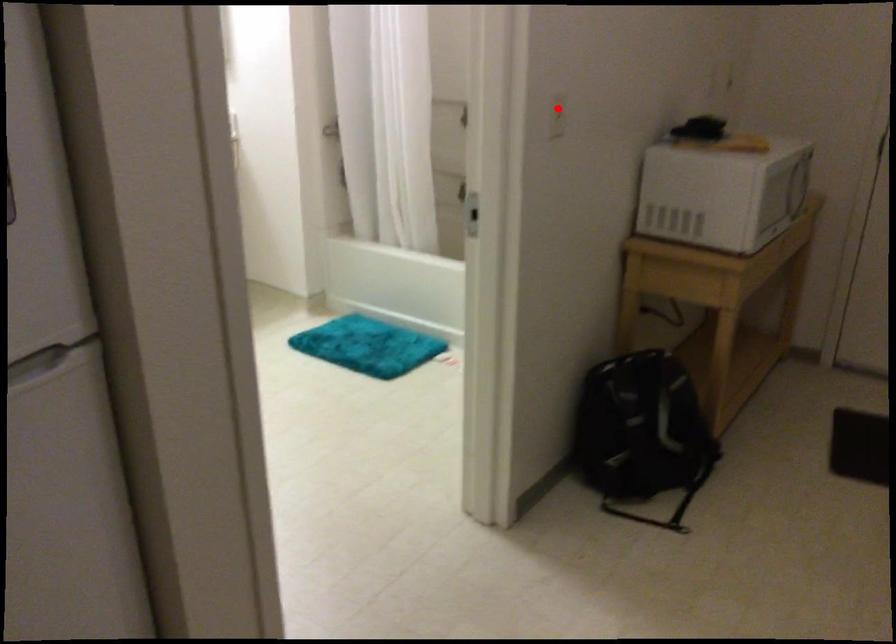
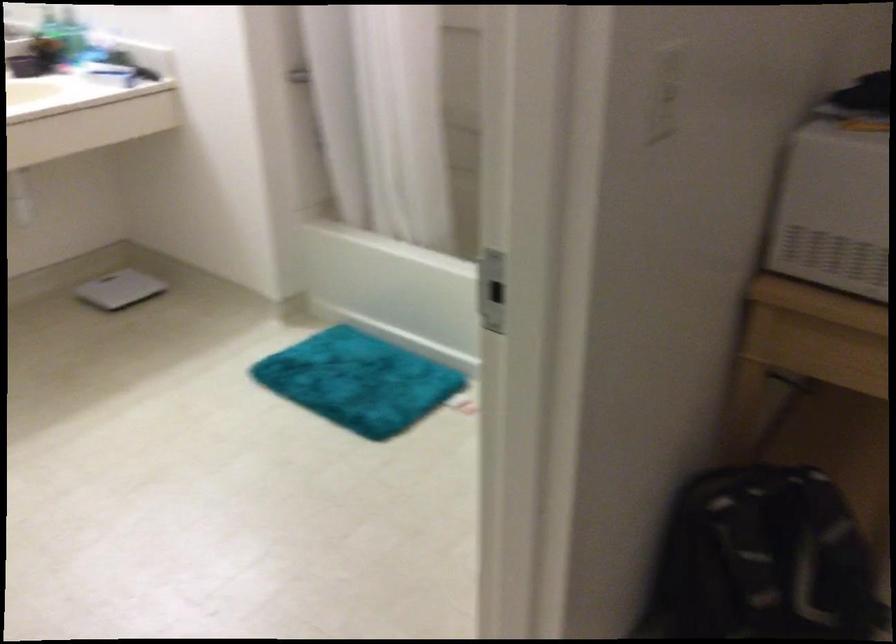
Where in the second image is the point corresponding to the highlighted location from the first image?

(666, 93)